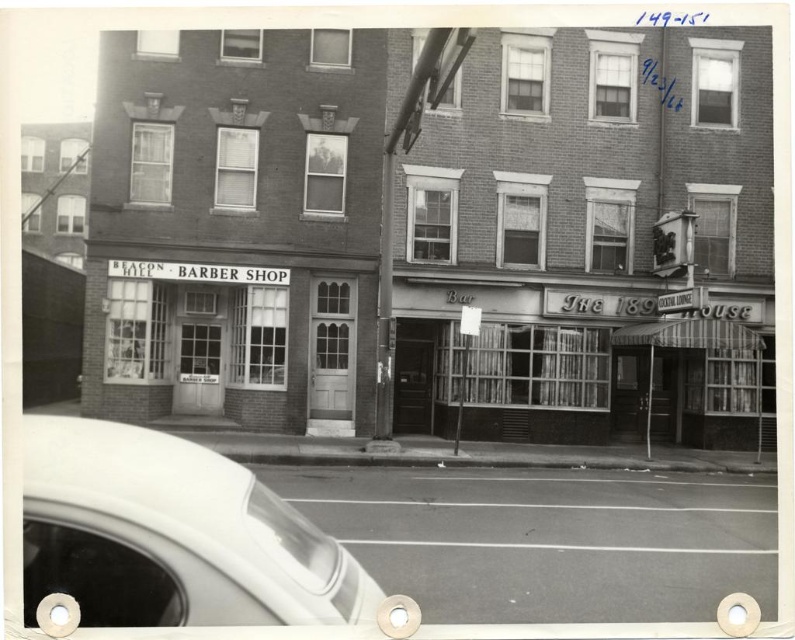
You are standing at the intersection and want to park your car. The parking spot you want is located at coordinate point 0.838, 0.218. Is the white glossy car at lower left already occupying that spot?

The white glossy car at lower left is located at point (173, 536), so yes, the white glossy car at lower left is occupying the parking spot at that coordinate point.

You are a pedestrian standing on the sidewalk in front of the Beacon Hill Barber Shop. You see a white glossy car at lower left and matte glass windows at center. Which object is nearer to you?

The white glossy car at lower left is closer to the viewer than the matte glass windows at center.